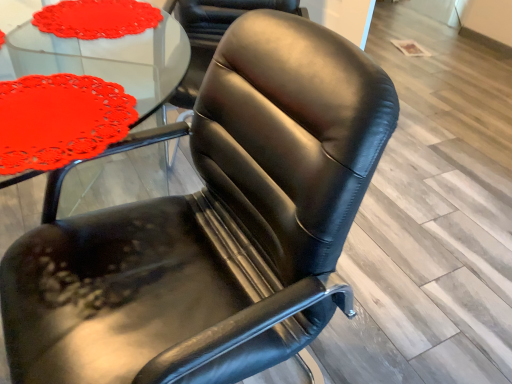
The height and width of the screenshot is (384, 512). What do you see at coordinates (97, 18) in the screenshot?
I see `matte red doily at upper left` at bounding box center [97, 18].

What do you see at coordinates (212, 34) in the screenshot? This screenshot has width=512, height=384. I see `black leather chair at center` at bounding box center [212, 34].

What is the approximate width of matte glass table at upper left?

16.32 inches.

Locate an element on the screen. matte red doily at upper left is located at coordinates (97, 18).

Considering the sizes of objects black leather chair at center and matte glass table at upper left in the image provided, who is bigger, black leather chair at center or matte glass table at upper left?

black leather chair at center is bigger.

At what (x,y) coordinates should I click in order to perform the action: click on chair above the matte glass table at upper left (from the image's perspective). Please return your answer as a coordinate pair (x, y). Looking at the image, I should click on (212, 34).

How distant is black leather chair at center from matte glass table at upper left?

black leather chair at center and matte glass table at upper left are 13.84 inches apart.

From the image's perspective, which one is positioned higher, black leather chair at center or matte glass table at upper left?

black leather chair at center appears higher in the image.

Looking at the image, does black leather chair at center seem bigger or smaller compared to matte red doily at upper left?

Considering their sizes, black leather chair at center takes up more space than matte red doily at upper left.

From the image's perspective, is black leather chair at center above or below matte red doily at upper left?

Based on their image positions, black leather chair at center is located above matte red doily at upper left.

Considering the positions of points (172, 0) and (119, 15), is point (172, 0) closer to camera compared to point (119, 15)?

That is False.

Between black leather chair at center and matte red doily at upper left, which one is positioned in front?

matte red doily at upper left.

Where is `table on the right of matte red doily at upper left`? table on the right of matte red doily at upper left is located at coordinates (110, 59).

Is matte red doily at upper left facing away from matte glass table at upper left?

matte red doily at upper left is not turned away from matte glass table at upper left.

From a real-world perspective, is matte red doily at upper left under matte glass table at upper left?

Yes.

From the image's perspective, is matte red doily at upper left located beneath matte glass table at upper left?

No.

Which is more to the right, matte red doily at upper left or black leather chair at center?

black leather chair at center.

Does matte red doily at upper left turn towards black leather chair at center?

Yes, matte red doily at upper left faces towards black leather chair at center.

Which object is closer to the camera, matte red doily at upper left or black leather chair at center?

matte red doily at upper left.

Looking at this image, from the image's perspective, does matte glass table at upper left appear lower than matte red doily at upper left?

Correct, matte glass table at upper left appears lower than matte red doily at upper left in the image.

From a real-world perspective, who is located higher, matte glass table at upper left or matte red doily at upper left?

matte glass table at upper left is physically above.

Who is taller, matte glass table at upper left or matte red doily at upper left?

matte glass table at upper left is taller.

Could matte red doily at upper left be considered to be inside matte glass table at upper left?

Actually, matte red doily at upper left is outside matte glass table at upper left.

Is matte glass table at upper left oriented towards black leather chair at center?

No, matte glass table at upper left is not aimed at black leather chair at center.

Can you confirm if matte glass table at upper left is taller than black leather chair at center?

No.

Is matte glass table at upper left outside of black leather chair at center?

Yes, matte glass table at upper left is not within black leather chair at center.

From the image's perspective, which is above, matte glass table at upper left or black leather chair at center?

From the image's view, black leather chair at center is above.

This screenshot has height=384, width=512. I want to click on chair on the right of matte glass table at upper left, so click(212, 34).

Locate an element on the screen. The height and width of the screenshot is (384, 512). tablecloth above the black leather chair at center (from a real-world perspective) is located at coordinates (97, 18).

When comparing their distances from matte glass table at upper left, does black leather chair at center or matte red doily at upper left seem closer?

The object closer to matte glass table at upper left is black leather chair at center.

Which object lies further to the anchor point black leather chair at center, matte glass table at upper left or matte red doily at upper left?

matte red doily at upper left lies further to black leather chair at center than the other object.

Considering their positions, is matte glass table at upper left positioned closer to matte red doily at upper left than black leather chair at center?

black leather chair at center.

Based on their spatial positions, is matte red doily at upper left or matte glass table at upper left closer to black leather chair at center?

matte glass table at upper left is closer to black leather chair at center.

Looking at the image, which one is located further to matte red doily at upper left, black leather chair at center or matte glass table at upper left?

Among the two, matte glass table at upper left is located further to matte red doily at upper left.

Looking at the image, which one is located further to matte glass table at upper left, matte red doily at upper left or black leather chair at center?

The object further to matte glass table at upper left is matte red doily at upper left.

You are a GUI agent. You are given a task and a screenshot of the screen. Output one action in this format:
    pyautogui.click(x=<x>, y=<y>)
    Task: Click on the tablecloth between matte glass table at upper left and black leather chair at center from front to back
    The width and height of the screenshot is (512, 384).
    Given the screenshot: What is the action you would take?
    pyautogui.click(x=97, y=18)